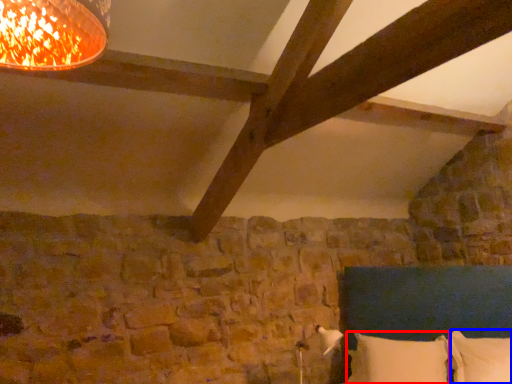
Question: Which object is further to the camera taking this photo, pillow (highlighted by a red box) or pillow (highlighted by a blue box)?

Choices:
 (A) pillow
 (B) pillow

Answer: (A)